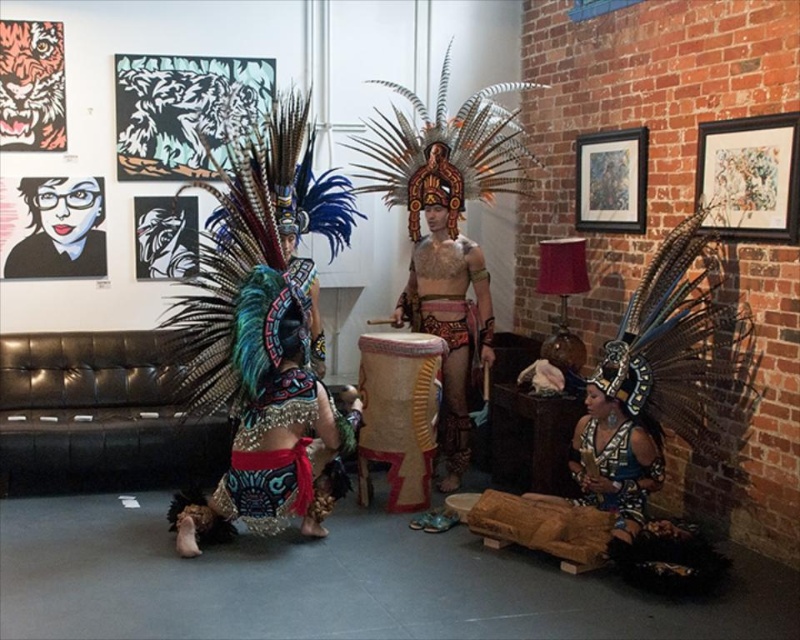
Can you confirm if matte black portrait at upper left is bigger than black paper mask at center?

Yes.

Looking at this image, is matte black portrait at upper left to the left of black paper mask at center from the viewer's perspective?

Correct, you'll find matte black portrait at upper left to the left of black paper mask at center.

What do you see at coordinates (60, 228) in the screenshot?
I see `matte black portrait at upper left` at bounding box center [60, 228].

At what (x,y) coordinates should I click in order to perform the action: click on matte black portrait at upper left. Please return your answer as a coordinate pair (x, y). This screenshot has height=640, width=800. Looking at the image, I should click on (60, 228).

Does shiny metallic skirt at center have a lesser width compared to shiny blue fabric headdress at lower right?

In fact, shiny metallic skirt at center might be wider than shiny blue fabric headdress at lower right.

From the picture: Does shiny metallic skirt at center lie in front of shiny blue fabric headdress at lower right?

No, it is behind shiny blue fabric headdress at lower right.

The width and height of the screenshot is (800, 640). I want to click on shiny metallic skirt at center, so click(x=274, y=456).

Which is above, shiny metallic skirt at center or matte black portrait at upper left?

Positioned higher is matte black portrait at upper left.

Does shiny metallic skirt at center appear over matte black portrait at upper left?

Result: Incorrect, shiny metallic skirt at center is not positioned above matte black portrait at upper left.

At what (x,y) coordinates should I click in order to perform the action: click on shiny metallic skirt at center. Please return your answer as a coordinate pair (x, y). This screenshot has width=800, height=640. Looking at the image, I should click on (274, 456).